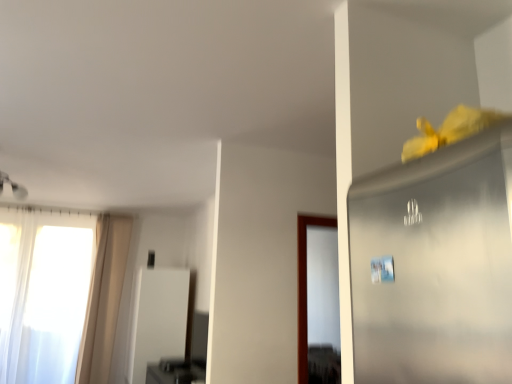
Measure the distance between white glossy screen door at center and camera.

15.08 feet.

Find the location of a particular element. The image size is (512, 384). white glossy screen door at center is located at coordinates (158, 319).

Is beige fabric curtain at left bigger or smaller than white glossy screen door at center?

beige fabric curtain at left is smaller than white glossy screen door at center.

Can we say beige fabric curtain at left lies outside white glossy screen door at center?

Absolutely, beige fabric curtain at left is external to white glossy screen door at center.

Could you tell me if beige fabric curtain at left is facing white glossy screen door at center?

No, beige fabric curtain at left is not facing towards white glossy screen door at center.

From a real-world perspective, between white glossy screen door at center and white sheer curtain at left, who is vertically higher?

From a 3D spatial view, white sheer curtain at left is above.

Considering the points (154, 329) and (87, 289), which point is in front, point (154, 329) or point (87, 289)?

Point (154, 329)

Are white glossy screen door at center and white sheer curtain at left far apart?

No, white glossy screen door at center is not far from white sheer curtain at left.

From their relative heights in the image, would you say white glossy screen door at center is taller or shorter than white sheer curtain at left?

Considering their sizes, white glossy screen door at center has less height than white sheer curtain at left.

In terms of width, does white glossy screen door at center look wider or thinner when compared to beige fabric curtain at left?

Considering their sizes, white glossy screen door at center looks broader than beige fabric curtain at left.

Is white glossy screen door at center to the right of beige fabric curtain at left from the viewer's perspective?

Yes, white glossy screen door at center is to the right of beige fabric curtain at left.

Is white glossy screen door at center located outside beige fabric curtain at left?

Yes.

Does white sheer curtain at left appear on the right side of white glossy screen door at center?

No, white sheer curtain at left is not to the right of white glossy screen door at center.

Does white sheer curtain at left lie in front of white glossy screen door at center?

No, it is not.

Considering the points (81, 287) and (141, 320), which point is in front, point (81, 287) or point (141, 320)?

The point (141, 320) is in front.

Who is smaller, white sheer curtain at left or white glossy screen door at center?

white sheer curtain at left is smaller.

Does point (98, 322) come closer to viewer compared to point (32, 365)?

No.

From a real-world perspective, is beige fabric curtain at left on white sheer curtain at left?

Yes, from a real-world perspective, beige fabric curtain at left is on top of white sheer curtain at left.

Is beige fabric curtain at left in front of white sheer curtain at left?

No.

Is beige fabric curtain at left located within white sheer curtain at left?

No, beige fabric curtain at left is not a part of white sheer curtain at left.

Is white sheer curtain at left with beige fabric curtain at left?

No, white sheer curtain at left is not touching beige fabric curtain at left.

From the image's perspective, is white sheer curtain at left above or below beige fabric curtain at left?

Clearly, from the image's perspective, white sheer curtain at left is below beige fabric curtain at left.

The image size is (512, 384). In order to click on curtain that appears above the white glossy screen door at center (from the image's perspective) in this screenshot , I will do click(104, 298).

Image resolution: width=512 pixels, height=384 pixels. What are the coordinates of `screen door on the right of white sheer curtain at left` in the screenshot? It's located at (158, 319).

Based on their spatial positions, is white sheer curtain at left or beige fabric curtain at left closer to white glossy screen door at center?

beige fabric curtain at left.

Based on their spatial positions, is white sheer curtain at left or white glossy screen door at center further from beige fabric curtain at left?

white glossy screen door at center.

Looking at the image, which one is located further to beige fabric curtain at left, white glossy screen door at center or white sheer curtain at left?

Based on the image, white glossy screen door at center appears to be further to beige fabric curtain at left.

When comparing their distances from white sheer curtain at left, does beige fabric curtain at left or white glossy screen door at center seem closer?

beige fabric curtain at left lies closer to white sheer curtain at left than the other object.

When comparing their distances from white sheer curtain at left, does white glossy screen door at center or beige fabric curtain at left seem further?

Among the two, white glossy screen door at center is located further to white sheer curtain at left.

Considering their positions, is beige fabric curtain at left positioned closer to white glossy screen door at center than white sheer curtain at left?

beige fabric curtain at left.

The image size is (512, 384). Identify the location of curtain between white sheer curtain at left and white glossy screen door at center. (104, 298).